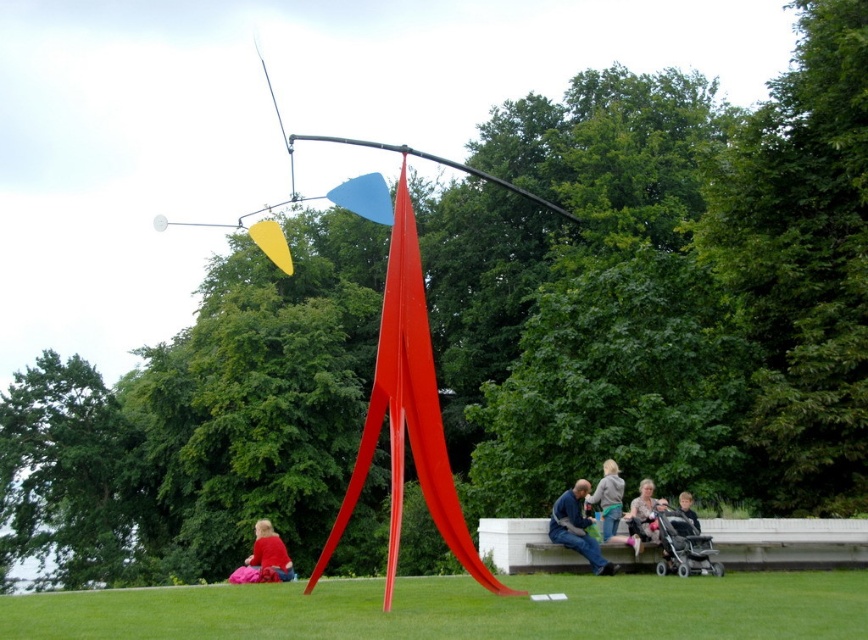
Who is positioned more to the right, blue fabric jacket at center or red fabric at lower left?

blue fabric jacket at center

Between blue fabric jacket at center and red fabric at lower left, which one is positioned higher?

blue fabric jacket at center

Is point (597, 573) less distant than point (262, 557)?

That is True.

Where is `blue fabric jacket at center`? blue fabric jacket at center is located at coordinates (577, 528).

Is blue fabric jacket at center to the left of smooth black hair at lower right from the viewer's perspective?

Yes, blue fabric jacket at center is to the left of smooth black hair at lower right.

Is blue fabric jacket at center to the right of smooth black hair at lower right from the viewer's perspective?

In fact, blue fabric jacket at center is to the left of smooth black hair at lower right.

The image size is (868, 640). What are the coordinates of `blue fabric jacket at center` in the screenshot? It's located at (577, 528).

In order to click on blue fabric jacket at center in this screenshot , I will do `click(577, 528)`.

Can you confirm if gray sweater at center is positioned below matte pink sweater at lower center?

No, gray sweater at center is not below matte pink sweater at lower center.

Does gray sweater at center appear on the left side of matte pink sweater at lower center?

Correct, you'll find gray sweater at center to the left of matte pink sweater at lower center.

Who is more forward, (603,486) or (651,516)?

Point (651,516) is in front.

Identify the location of gray sweater at center. This screenshot has width=868, height=640. (608, 499).